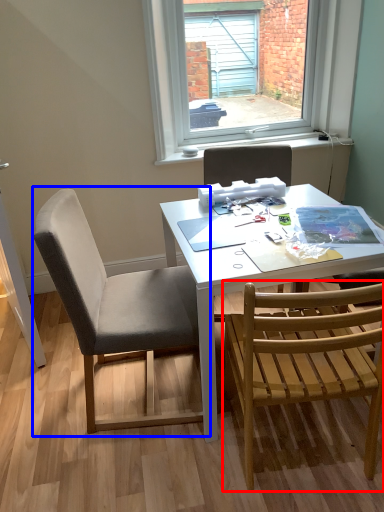
Question: Which of the following is the farthest to the observer, chair (highlighted by a red box) or chair (highlighted by a blue box)?

Choices:
 (A) chair
 (B) chair

Answer: (B)